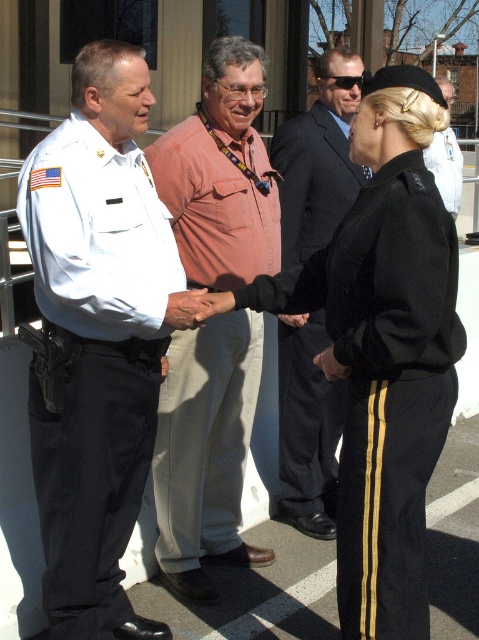
Based on the scene description, where is the black uniform at center located in terms of coordinates?

The black uniform at center is located at point (384, 349).

You are a photographer at a formal event. You need to capture a clear photo of the dark gray suit at center without the black uniform at center blocking it. Is this possible given their positions?

The black uniform at center is positioned over dark gray suit at center, so it is blocking the view. Therefore, it is not possible to capture a clear photo of the dark gray suit at center without the black uniform at center blocking it.

You are observing a handshake between two people in the image. The black uniform at center and the pink cotton shirt at center are involved. From the perspective of someone facing the scene, which one is on the left?

The pink cotton shirt at center is on the left side because the black uniform at center is positioned on the right side of it.